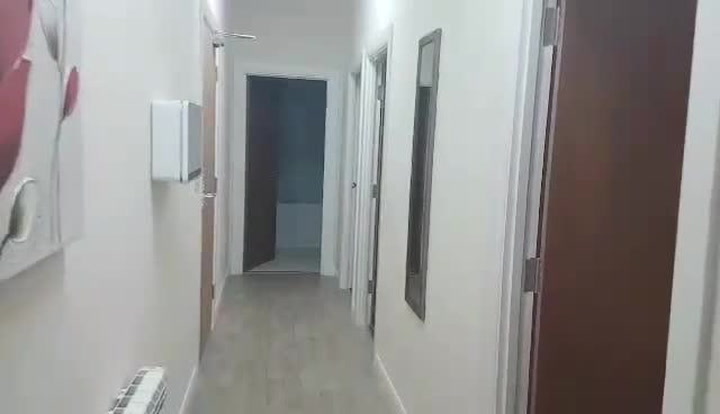
Locate an element on the screen. The width and height of the screenshot is (720, 414). door frame is located at coordinates (510, 396), (516, 207), (533, 60), (366, 38), (361, 192), (392, 29), (320, 75), (261, 77), (327, 209), (240, 196).